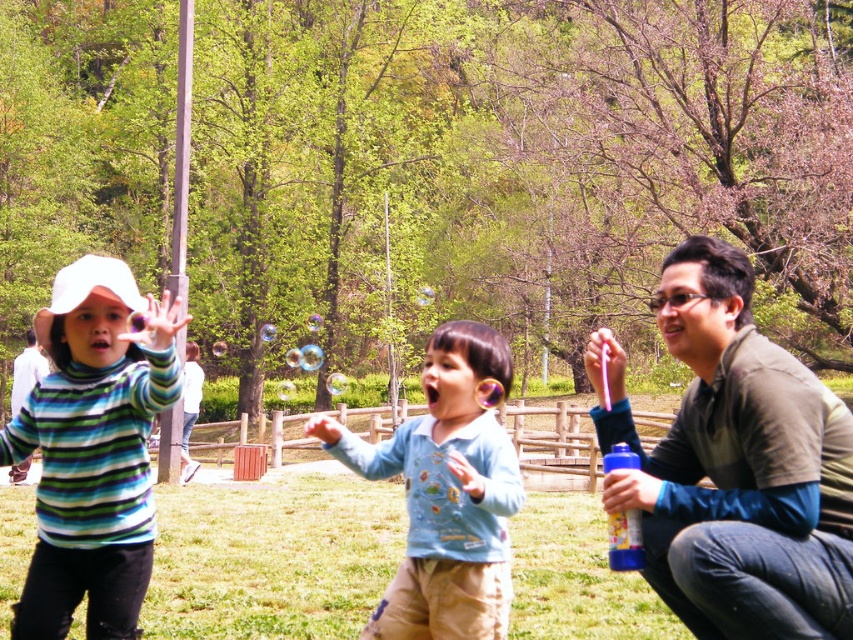
From the picture: You are standing at the origin of the coordinate system in the park scene. You see two points marked in the image. Which point is closer to you, point (274, 600) or point (462, 586)?

Point (462, 586) is closer to you because it is in front of point (274, 600).

You are a photographer trying to capture a photo of the blue cotton shirt at center and the green grass at center. Which object is located to the right of the other?

The blue cotton shirt at center is positioned to the right of the green grass at center.